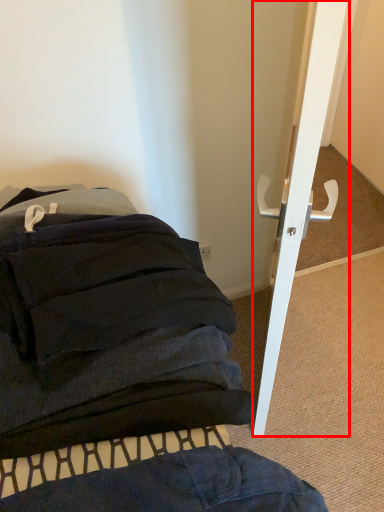
Question: From the image's perspective, considering the relative positions of door (annotated by the red box) and furniture in the image provided, where is door (annotated by the red box) located with respect to the staircase?

Choices:
 (A) below
 (B) above

Answer: (B)